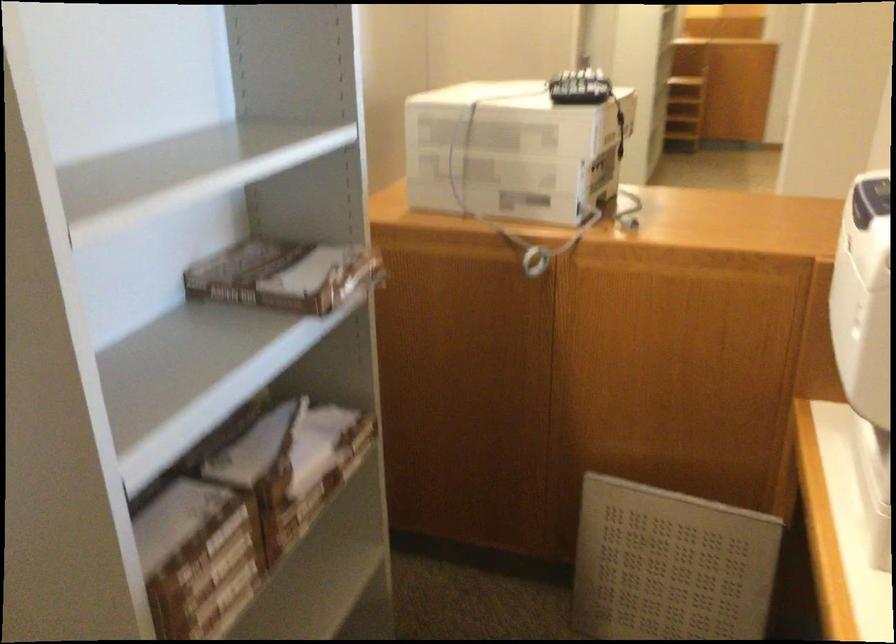
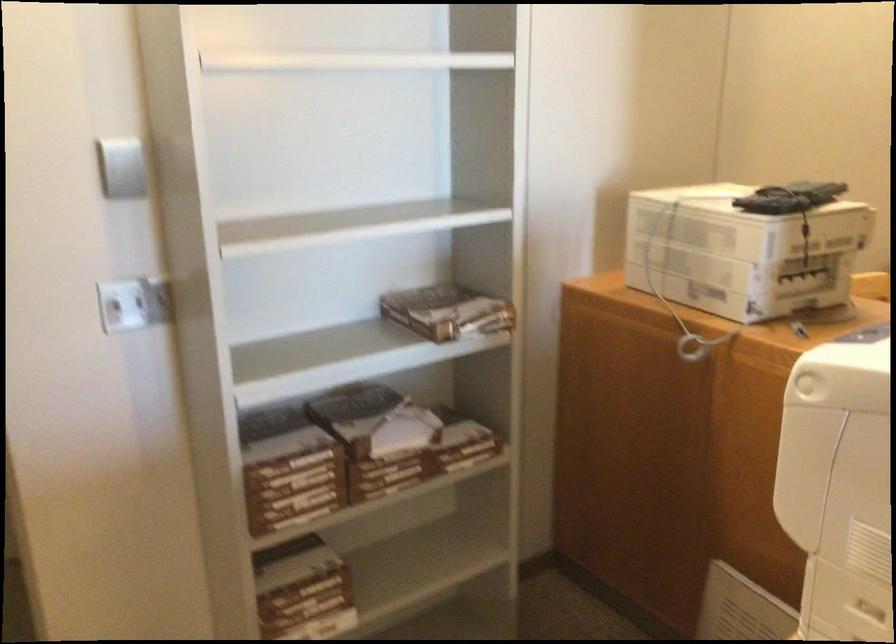
Question: The camera is either moving clockwise (left) or counter-clockwise (right) around the object. The first image is from the beginning of the video and the second image is from the end. Is the camera moving left or right when shooting the video?

Choices:
 (A) Left
 (B) Right

Answer: (B)